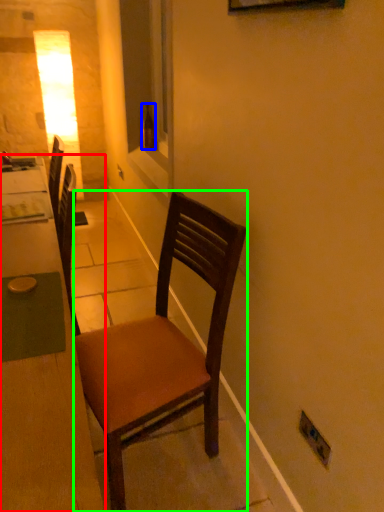
Question: Which object is the farthest from desk (highlighted by a red box)? Choose among these: bottle (highlighted by a blue box) or chair (highlighted by a green box).

Choices:
 (A) bottle
 (B) chair

Answer: (A)